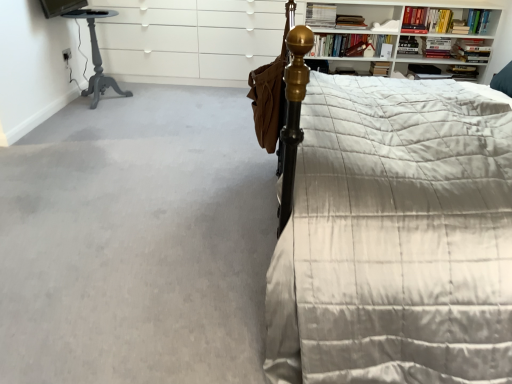
Question: Considering the relative positions of hardcover book at upper right, acting as the 4th book starting from the left, and hardcover book at upper center, which is the 1th book in left-to-right order, in the image provided, is hardcover book at upper right, acting as the 4th book starting from the left, to the left or to the right of hardcover book at upper center, which is the 1th book in left-to-right order,?

Choices:
 (A) left
 (B) right

Answer: (B)

Question: Is hardcover book at upper right, acting as the 4th book starting from the left, wider or thinner than hardcover book at upper center, which ranks as the eighth book in right-to-left order?

Choices:
 (A) thin
 (B) wide

Answer: (B)

Question: Which object is positioned closest to the hardcover book at upper right, which is the seventh book in left-to-right order?

Choices:
 (A) hardcover book at upper center, the 7th book positioned from the right
 (B) hardcover book at upper center, which is the 1th book in left-to-right order
 (C) hardcover book at upper right, which ranks as the 3th book in left-to-right order
 (D) hardcover book at upper right, the third book in the right-to-left sequence
 (E) gray carpet at lower left

Answer: (D)

Question: Estimate the real-world distances between objects in this image. Which object is farther from the white matte cabinet at upper center?

Choices:
 (A) hardcover book at upper right, marked as the 6th book in a left-to-right arrangement
 (B) hardcover book at upper right, positioned as the sixth book in right-to-left order
 (C) hardcover book at upper right, positioned as the 5th book in right-to-left order
 (D) hardcover book at upper center, the 7th book positioned from the right
 (E) gray carpet at lower left

Answer: (A)